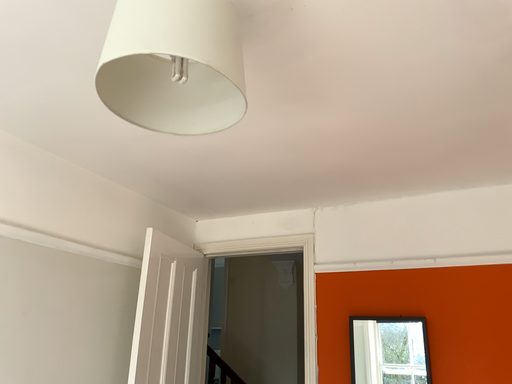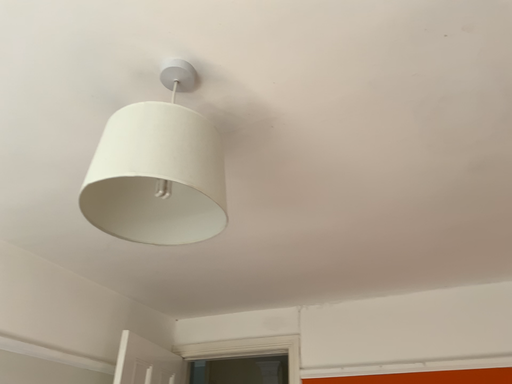
Question: Which way did the camera rotate in the video?

Choices:
 (A) rotated downward
 (B) rotated upward

Answer: (B)